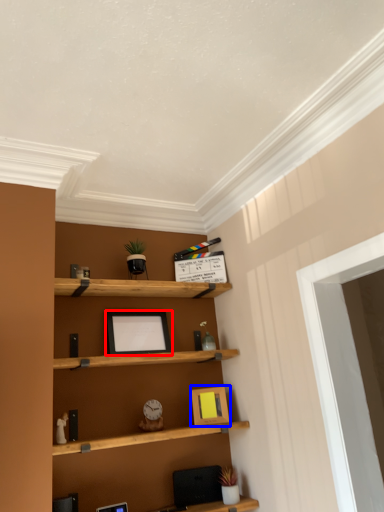
Question: Among these objects, which one is nearest to the camera, picture frame (highlighted by a red box) or picture frame (highlighted by a blue box)?

Choices:
 (A) picture frame
 (B) picture frame

Answer: (A)